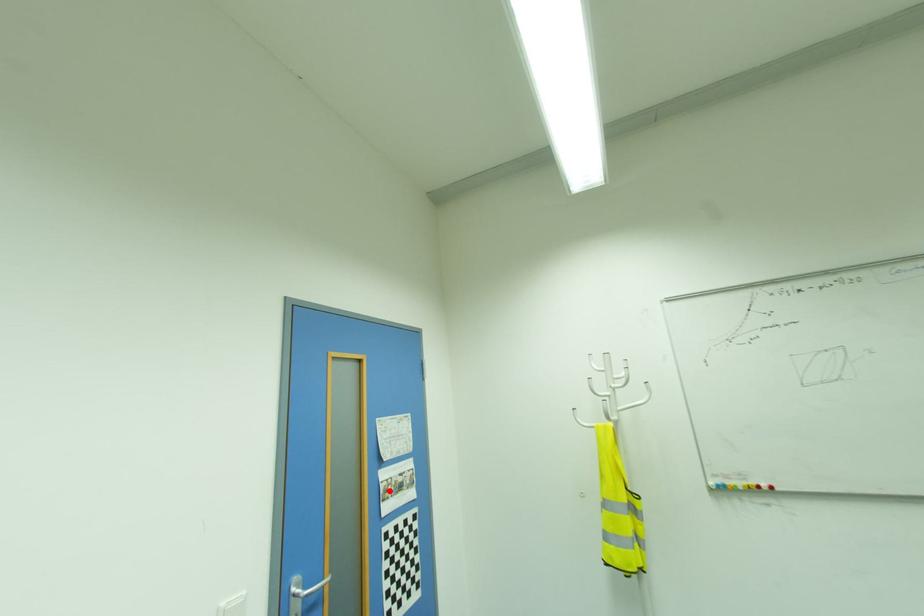
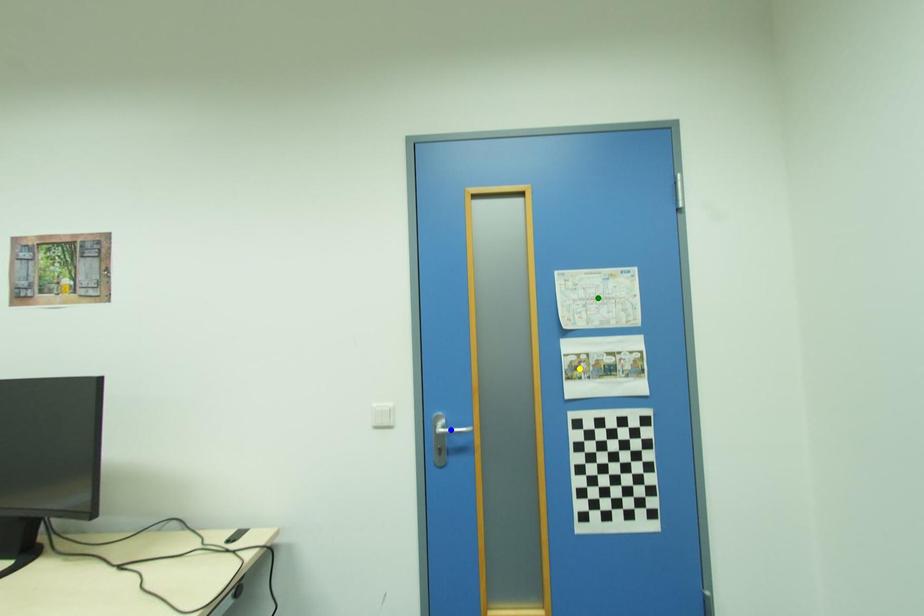
Question: I am providing you with two images of the same scene from different viewpoints. A red point is marked on the first image. You are given multiple points on the second image. In image 2, which mark is for the same physical point as the one in image 1?

Choices:
 (A) yellow point
 (B) blue point
 (C) green point

Answer: (A)